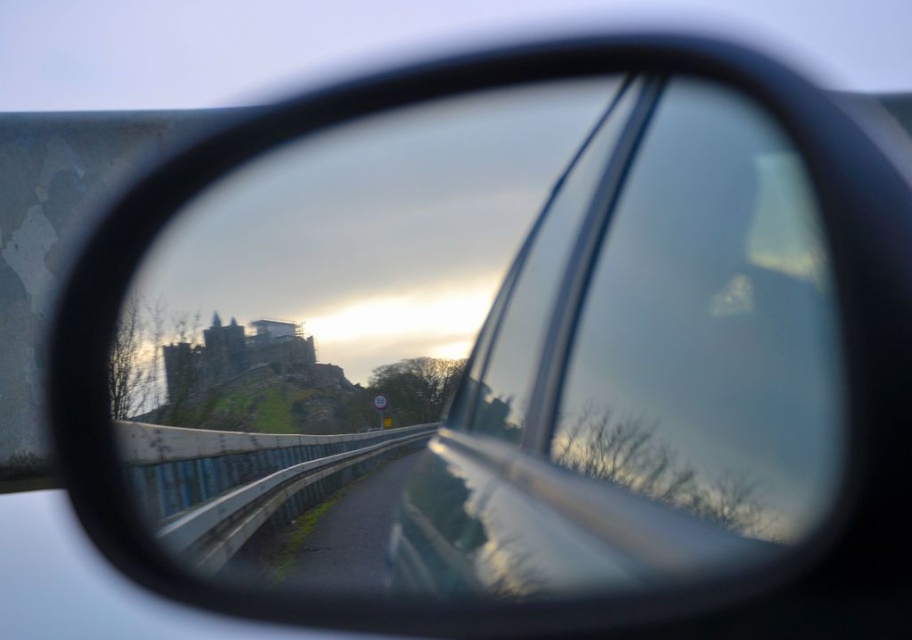
Is point (221, 177) in front of point (723, 486)?

That is False.

Between glossy metallic mirror at center and metallic silver car window at center, which one appears on the left side from the viewer's perspective?

From the viewer's perspective, glossy metallic mirror at center appears more on the left side.

Where is `glossy metallic mirror at center`? The width and height of the screenshot is (912, 640). glossy metallic mirror at center is located at coordinates (372, 344).

You are a GUI agent. You are given a task and a screenshot of the screen. Output one action in this format:
    pyautogui.click(x=<x>, y=<y>)
    Task: Click on the glossy metallic mirror at center
    The width and height of the screenshot is (912, 640).
    Given the screenshot: What is the action you would take?
    pyautogui.click(x=372, y=344)